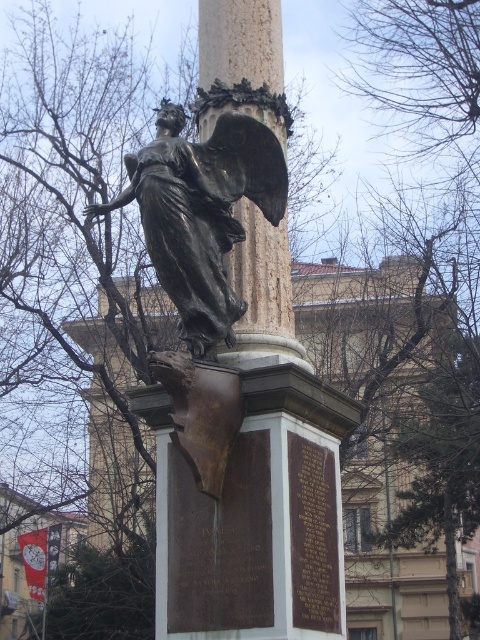
Can you confirm if bronze statue at center is bigger than marble column at center?

Incorrect, bronze statue at center is not larger than marble column at center.

Between bronze statue at center and marble column at center, which one has more height?

marble column at center is taller.

Does point (233, 193) come farther from viewer compared to point (276, 42)?

No, it is not.

Identify the location of bronze statue at center. (202, 212).